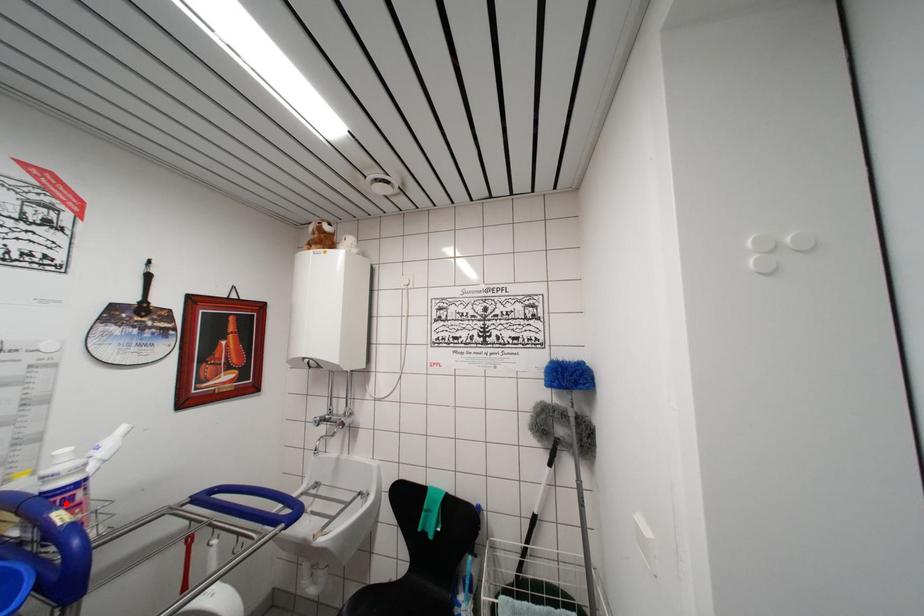
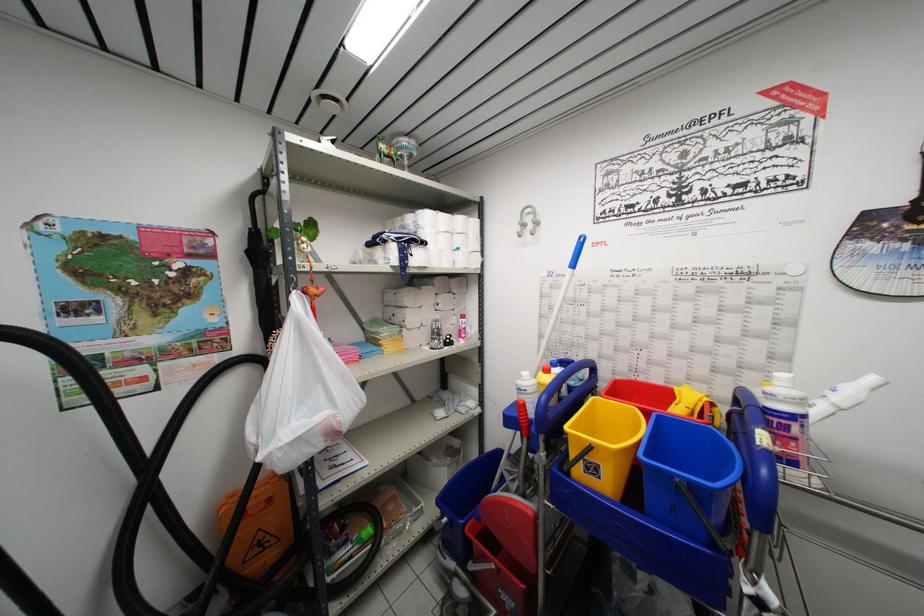
Question: I am providing you with two images of the same scene from different viewpoints. Image1 has a red point marked. In image2, the corresponding 3D location appears at what relative position? Reply with the corresponding letter.

Choices:
 (A) Closer
 (B) Farther

Answer: (B)